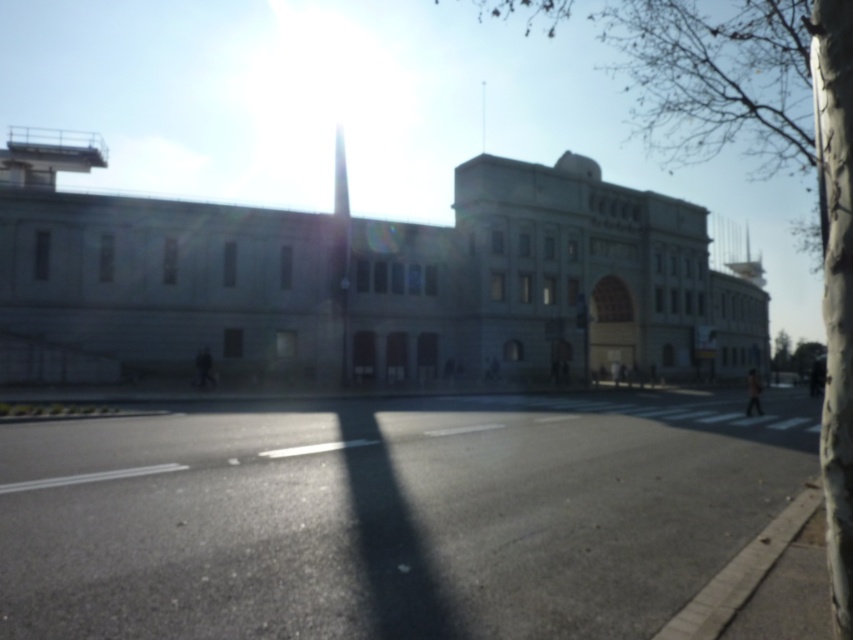
Question: Is bare bark tree at upper right thinner than green leafy tree at right?

Choices:
 (A) no
 (B) yes

Answer: (A)

Question: Can you confirm if bare bark tree at upper right is positioned to the right of green leafy tree at right?

Choices:
 (A) yes
 (B) no

Answer: (B)

Question: Which of the following is the closest to the observer?

Choices:
 (A) (776, 356)
 (B) (827, 536)

Answer: (B)

Question: Which of the following is the farthest from the observer?

Choices:
 (A) bare bark tree at upper right
 (B) green leafy tree at right

Answer: (B)

Question: Is bare bark tree at upper right further to the viewer compared to green leafy tree at right?

Choices:
 (A) yes
 (B) no

Answer: (B)